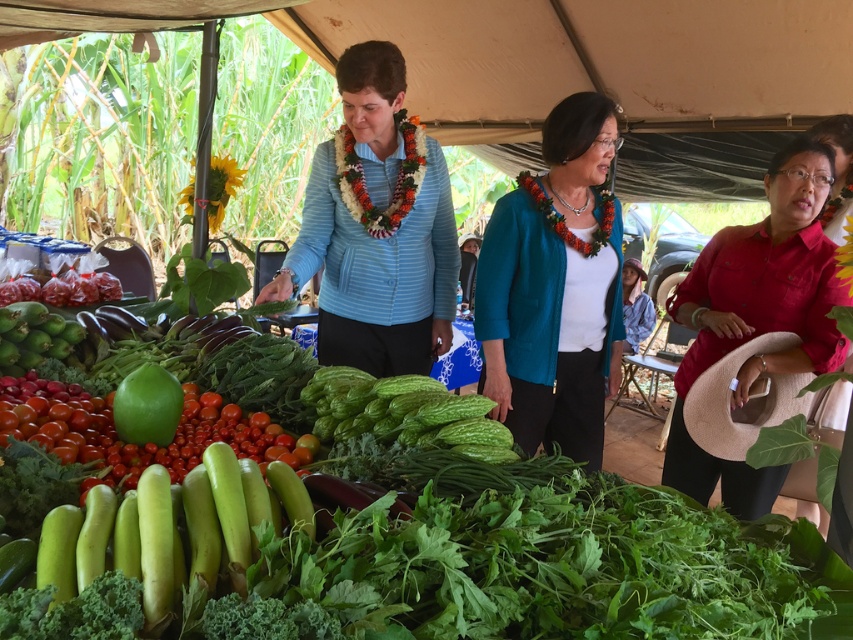
You are a customer who wants to ask the woman in the teal fabric jacket at center a question about the produce. You are currently standing 2 meters away from her. Can you reach her without moving closer than 2 meters?

The woman in the teal fabric jacket at center is 2.01 meters away from you, so you cannot reach her without moving closer than 2 meters.

In the market scene, there is a red matte shirt at right and a green matte melon at center. Which object is positioned to the right of the other?

The red matte shirt at right is positioned to the right of the green matte melon at center.